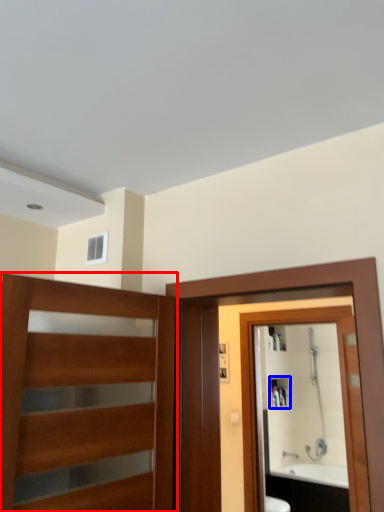
Question: Which object appears farthest to the camera in this image, door (highlighted by a red box) or cabinet (highlighted by a blue box)?

Choices:
 (A) door
 (B) cabinet

Answer: (B)